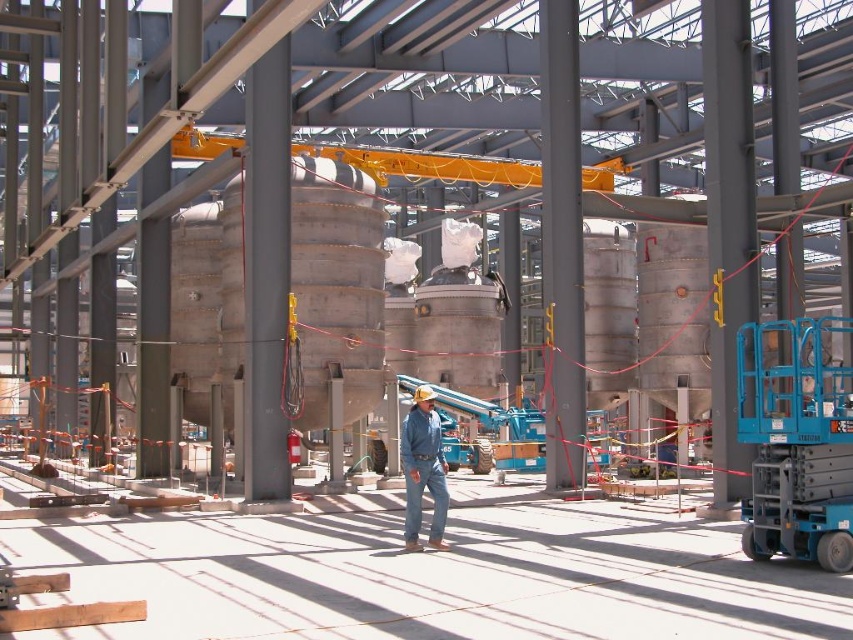
You are a construction worker standing at the point marked by coordinates point (x=503, y=428). You need to locate the blue metallic forklift at center. Which direction should you walk to reach it?

The point (x=503, y=428) marks the blue metallic forklift at center, so you are already at the location of the blue metallic forklift at center.

Based on the photo, you are a safety inspector at the construction site. You notice two items labeled as blue denim jeans at center and denim at center. Which item is closer to you?

The blue denim jeans at center is closer to the viewer than denim at center.